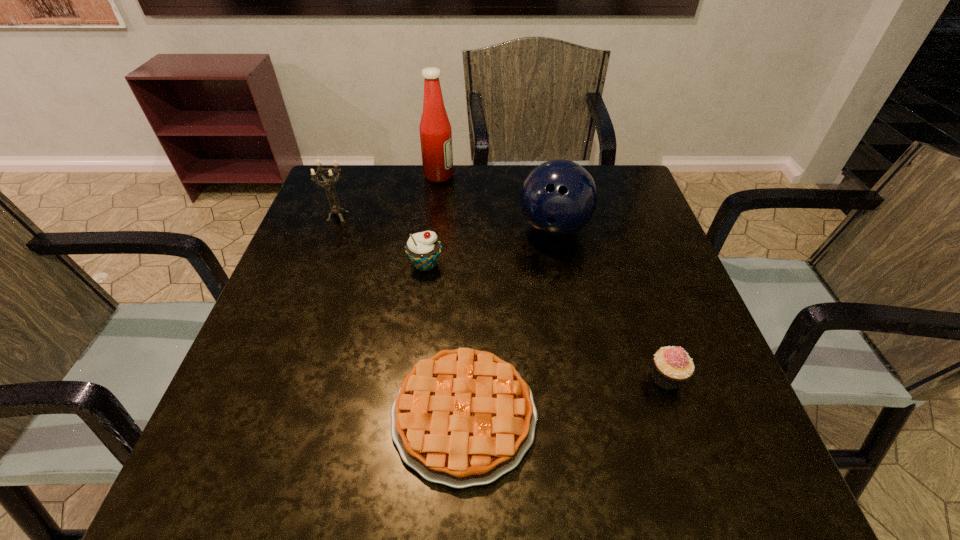
What are the coordinates of `free spot that satisfies the following two spatial constraints: 1. on the front side of the pie; 2. on the left side of the leftmost object` in the screenshot? It's located at (263, 415).

Locate an element on the screen. vacant space that satisfies the following two spatial constraints: 1. on the back side of the pie; 2. on the left side of the second shortest object is located at coordinates (465, 378).

Where is `free point that satisfies the following two spatial constraints: 1. on the front-facing side of the shorter cupcake; 2. on the left side of the condiment`? free point that satisfies the following two spatial constraints: 1. on the front-facing side of the shorter cupcake; 2. on the left side of the condiment is located at coordinates (415, 378).

Find the location of `free space that satisfies the following two spatial constraints: 1. on the front-facing side of the farthest object; 2. on the back side of the shorter cupcake`. free space that satisfies the following two spatial constraints: 1. on the front-facing side of the farthest object; 2. on the back side of the shorter cupcake is located at coordinates (415, 378).